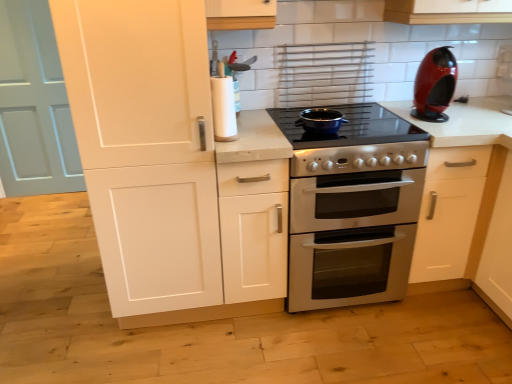
You are a GUI agent. You are given a task and a screenshot of the screen. Output one action in this format:
    pyautogui.click(x=<x>, y=<y>)
    Task: Click on the vacant space behind matte black pot at center
    
    Given the screenshot: What is the action you would take?
    point(319,114)